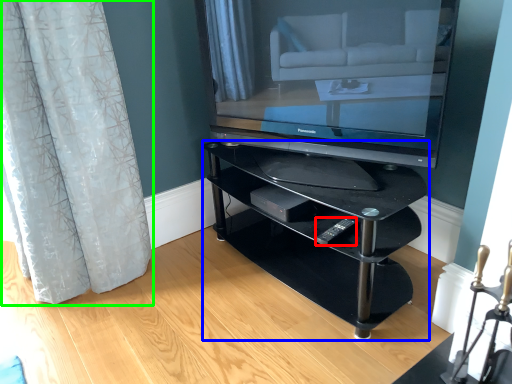
Question: Which object is the farthest from remote (highlighted by a red box)? Choose among these: shelf (highlighted by a blue box) or curtain (highlighted by a green box).

Choices:
 (A) shelf
 (B) curtain

Answer: (B)